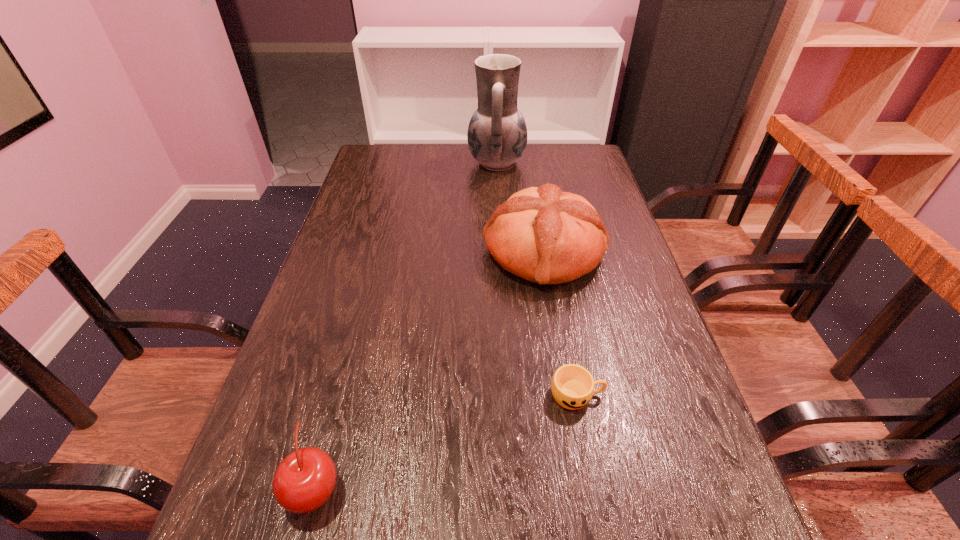
Where is `blank space located on the front-facing side of the pitcher`? Image resolution: width=960 pixels, height=540 pixels. blank space located on the front-facing side of the pitcher is located at coordinates (379, 163).

I want to click on free location located 0.230m on the left of the third shortest object, so click(396, 252).

This screenshot has height=540, width=960. What are the coordinates of `vacant space located on the right of the third tallest object` in the screenshot? It's located at (397, 488).

Where is `free space located on the back of the shortest object`? The height and width of the screenshot is (540, 960). free space located on the back of the shortest object is located at coordinates (553, 264).

Identify the location of object that is at the far edge. The image size is (960, 540). (497, 134).

Locate an element on the screen. Image resolution: width=960 pixels, height=540 pixels. object located at the left edge is located at coordinates (305, 479).

The height and width of the screenshot is (540, 960). I want to click on object that is at the right edge, so click(544, 235).

This screenshot has width=960, height=540. I want to click on vacant region at the far edge of the desktop, so pos(526,178).

Identify the location of free space at the left edge. This screenshot has width=960, height=540. (332, 353).

The width and height of the screenshot is (960, 540). I want to click on free location at the right edge of the desktop, so (676, 357).